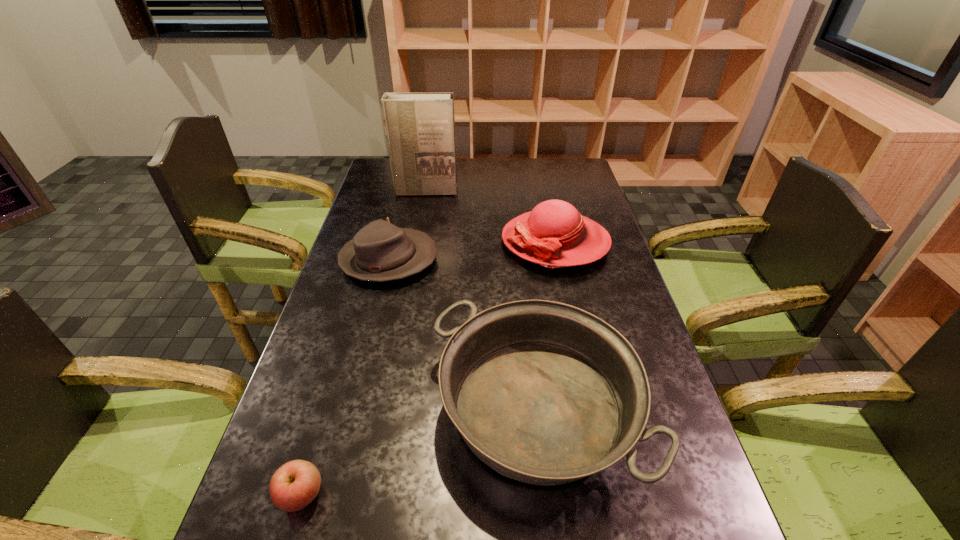
The height and width of the screenshot is (540, 960). Identify the location of object at the far left corner. (420, 127).

In the image, there is a desktop. Where is `vacant space at the far edge`? Image resolution: width=960 pixels, height=540 pixels. vacant space at the far edge is located at coordinates (503, 165).

Find the location of a particular element. vacant point at the left edge is located at coordinates (321, 393).

At what (x,y) coordinates should I click in order to perform the action: click on free space at the right edge of the desktop. Please return your answer as a coordinate pair (x, y). This screenshot has width=960, height=540. Looking at the image, I should click on (682, 448).

Find the location of a particular element. The height and width of the screenshot is (540, 960). free spot between the phonebook and the shortest object is located at coordinates (363, 343).

The width and height of the screenshot is (960, 540). Identify the location of vacant space that is in between the right hat and the shortest object. (428, 368).

This screenshot has width=960, height=540. In order to click on free space between the fourth tallest object and the right hat in this screenshot , I will do `click(472, 251)`.

Find the location of a particular element. The height and width of the screenshot is (540, 960). free space between the left hat and the tallest object is located at coordinates (407, 226).

At what (x,y) coordinates should I click in order to perform the action: click on empty space that is in between the pan and the tallest object. Please return your answer as a coordinate pair (x, y). Image resolution: width=960 pixels, height=540 pixels. Looking at the image, I should click on (481, 300).

Locate an element on the screen. The width and height of the screenshot is (960, 540). unoccupied position between the shorter hat and the apple is located at coordinates (345, 378).